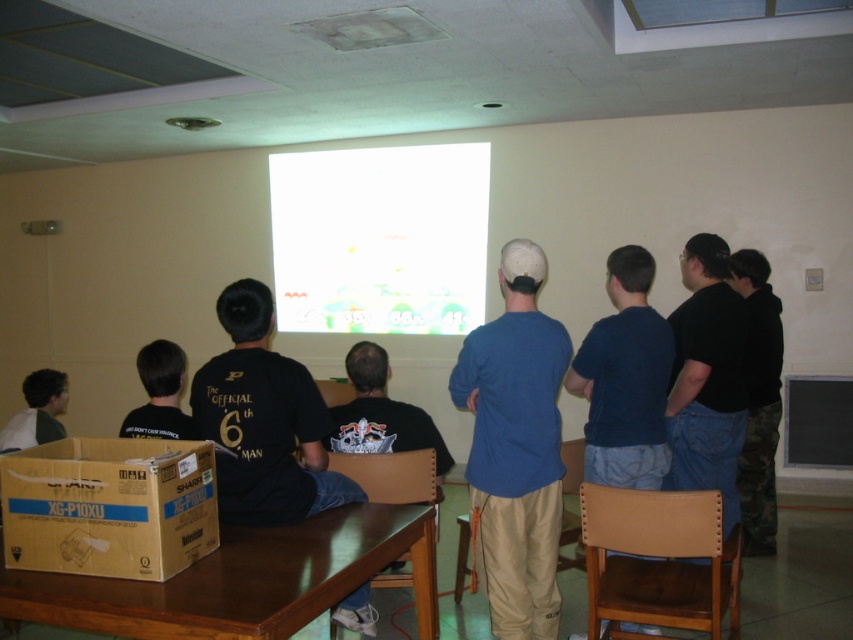
Question: Which point is farther to the camera?

Choices:
 (A) blue cotton shirt at center
 (B) black matte shirt at center

Answer: (B)

Question: Can you confirm if brown wooden table at lower left is positioned to the right of dark blue t-shirt at center?

Choices:
 (A) no
 (B) yes

Answer: (A)

Question: Estimate the real-world distances between objects in this image. Which object is farther from the black matte shirt at center?

Choices:
 (A) white t-shirt at lower left
 (B) black cotton hoodie at right
 (C) blue cotton shirt at center

Answer: (B)

Question: Is white glossy projection screen at center bigger than black cotton hoodie at right?

Choices:
 (A) yes
 (B) no

Answer: (A)

Question: Is black t-shirt at center to the left of dark blue t-shirt at center from the viewer's perspective?

Choices:
 (A) no
 (B) yes

Answer: (B)

Question: Among these points, which one is nearest to the camera?

Choices:
 (A) (103, 564)
 (B) (363, 550)
 (C) (753, 493)
 (D) (48, 428)

Answer: (A)